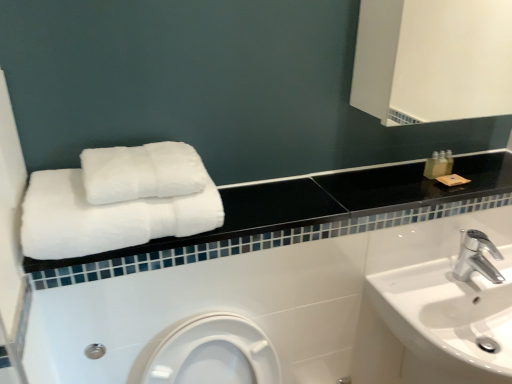
Question: Considering the relative sizes of translucent plastic bottle at upper right and white fluffy towels at upper left, which is counted as the first towel, starting from the bottom, in the image provided, is translucent plastic bottle at upper right bigger than white fluffy towels at upper left, which is counted as the first towel, starting from the bottom,?

Choices:
 (A) no
 (B) yes

Answer: (A)

Question: Can you confirm if translucent plastic bottle at upper right is taller than white fluffy towels at upper left, which is the 2th towel from top to bottom?

Choices:
 (A) no
 (B) yes

Answer: (A)

Question: Could you tell me if translucent plastic bottle at upper right is turned towards white fluffy towels at upper left, which is counted as the first towel, starting from the bottom?

Choices:
 (A) no
 (B) yes

Answer: (A)

Question: Does translucent plastic bottle at upper right come in front of white fluffy towels at upper left, which is the 2th towel from top to bottom?

Choices:
 (A) yes
 (B) no

Answer: (B)

Question: Does translucent plastic bottle at upper right contain white fluffy towels at upper left, which is counted as the first towel, starting from the bottom?

Choices:
 (A) no
 (B) yes

Answer: (A)

Question: In terms of size, does translucent plastic bottle at upper right appear bigger or smaller than white soft towels at upper left?

Choices:
 (A) big
 (B) small

Answer: (B)

Question: In the image, is translucent plastic bottle at upper right on the left side or the right side of white soft towels at upper left?

Choices:
 (A) left
 (B) right

Answer: (B)

Question: In terms of width, does translucent plastic bottle at upper right look wider or thinner when compared to white soft towels at upper left?

Choices:
 (A) thin
 (B) wide

Answer: (A)

Question: From a real-world perspective, is translucent plastic bottle at upper right positioned above or below white soft towels at upper left?

Choices:
 (A) below
 (B) above

Answer: (B)

Question: Considering the positions of white glossy sink at lower right and white fluffy towels at upper left, which is the 2th towel from top to bottom, in the image, is white glossy sink at lower right taller or shorter than white fluffy towels at upper left, which is the 2th towel from top to bottom,?

Choices:
 (A) short
 (B) tall

Answer: (B)

Question: From the image's perspective, is white glossy sink at lower right positioned above or below white fluffy towels at upper left, which is the 2th towel from top to bottom?

Choices:
 (A) below
 (B) above

Answer: (A)

Question: Is white glossy sink at lower right bigger or smaller than white fluffy towels at upper left, which is counted as the first towel, starting from the bottom?

Choices:
 (A) small
 (B) big

Answer: (B)

Question: Considering their positions, is white glossy sink at lower right located in front of or behind white fluffy towels at upper left, which is counted as the first towel, starting from the bottom?

Choices:
 (A) front
 (B) behind

Answer: (B)

Question: From the image's perspective, is silver metallic faucet at lower right located above or below white glossy sink at lower right?

Choices:
 (A) below
 (B) above

Answer: (B)

Question: In terms of width, does silver metallic faucet at lower right look wider or thinner when compared to white glossy sink at lower right?

Choices:
 (A) thin
 (B) wide

Answer: (A)